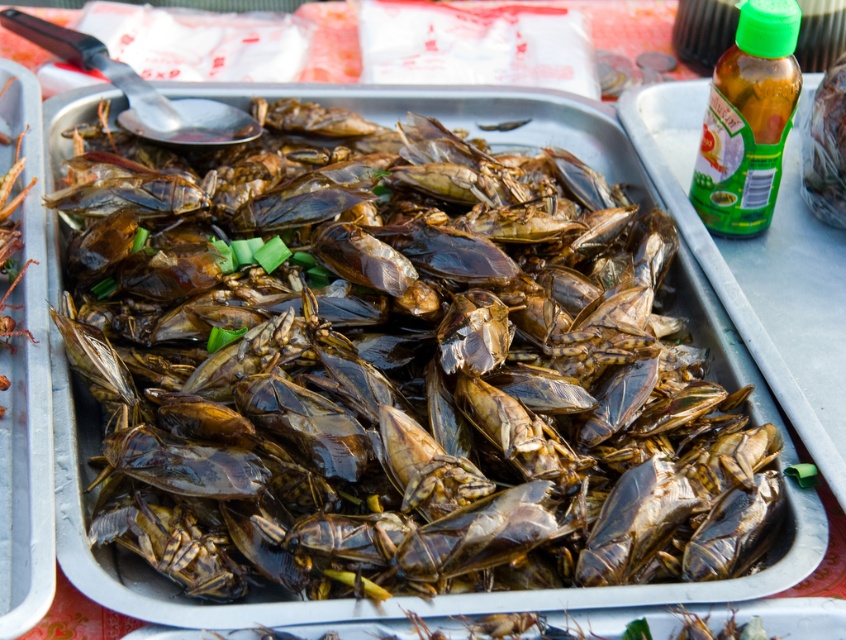
Question: Observing the image, what is the correct spatial positioning of shiny brown insects at center in reference to green plastic bottle at upper right?

Choices:
 (A) below
 (B) above

Answer: (A)

Question: Which point appears closest to the camera in this image?

Choices:
 (A) (743, 109)
 (B) (742, 476)

Answer: (B)

Question: Does shiny brown insects at center have a smaller size compared to green plastic bottle at upper right?

Choices:
 (A) yes
 (B) no

Answer: (B)

Question: Which point is closer to the camera?

Choices:
 (A) (221, 536)
 (B) (765, 1)

Answer: (A)

Question: Is shiny brown insects at center wider than green plastic bottle at upper right?

Choices:
 (A) yes
 (B) no

Answer: (A)